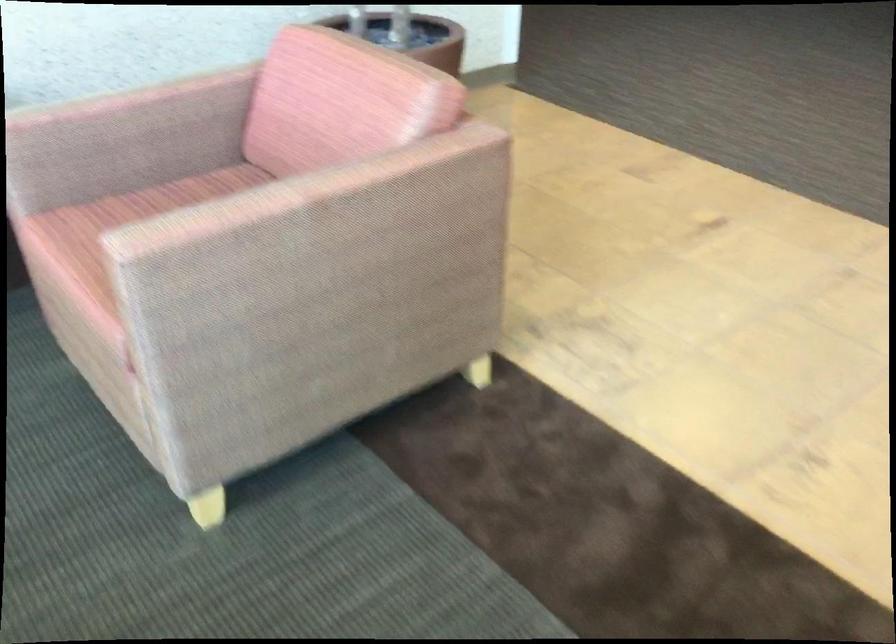
Describe the element at coordinates (88, 238) in the screenshot. This screenshot has height=644, width=896. I see `a pink chair sitting surface` at that location.